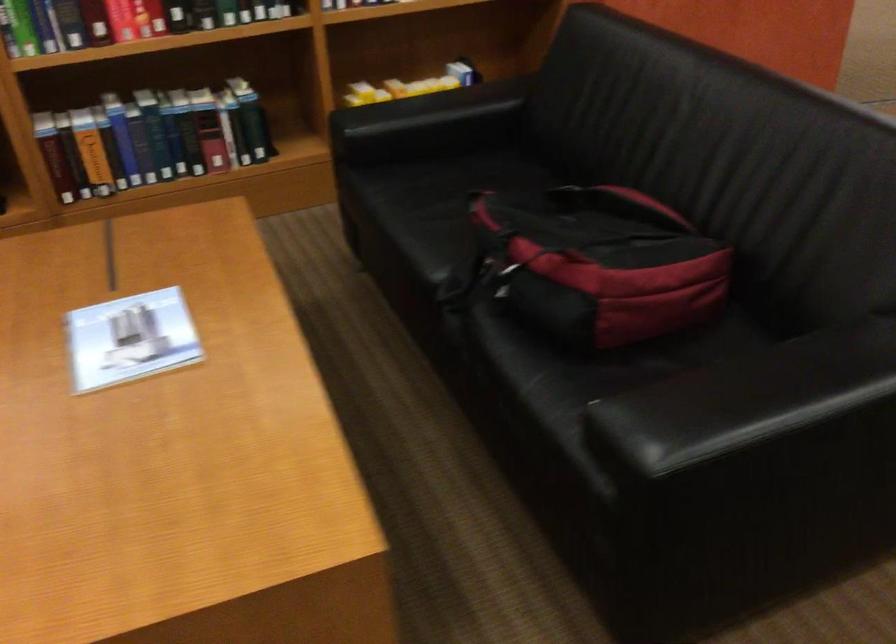
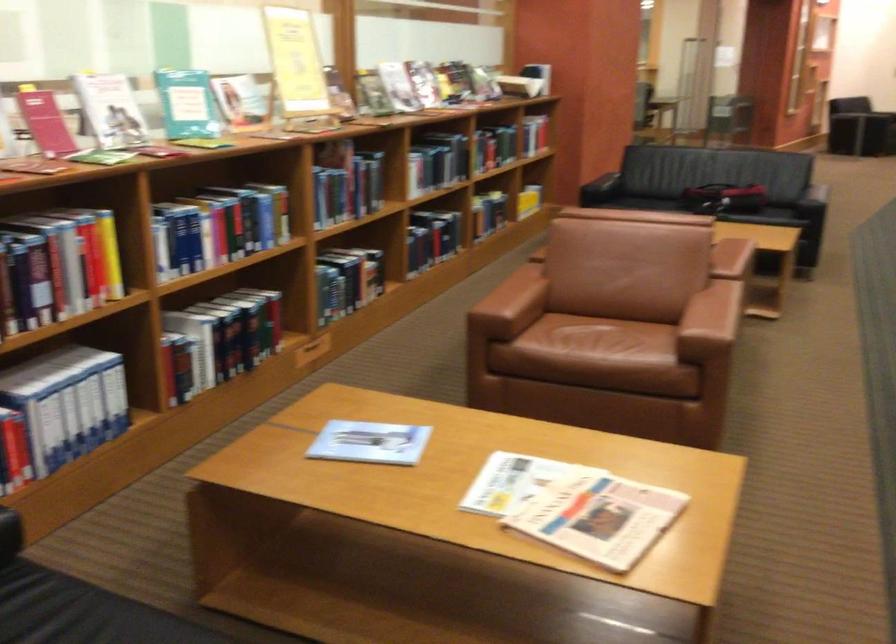
In the second image, find the point that corresponds to (410,86) in the first image.

(537, 184)